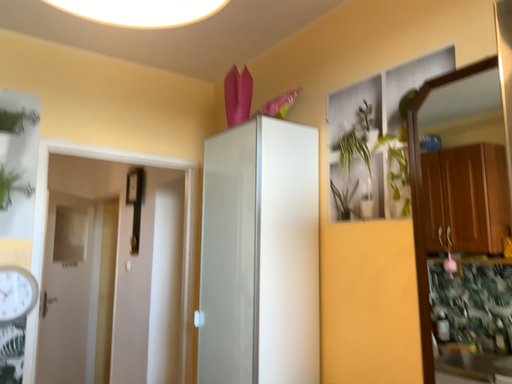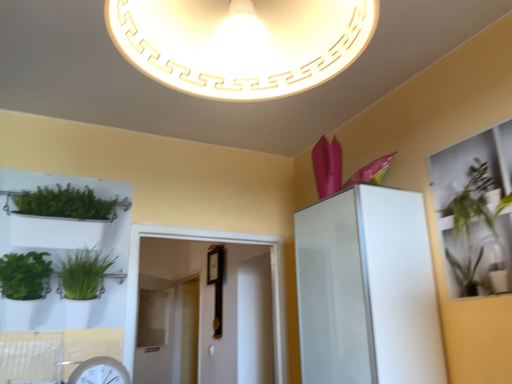
Question: How did the camera likely rotate when shooting the video?

Choices:
 (A) rotated left
 (B) rotated right

Answer: (A)